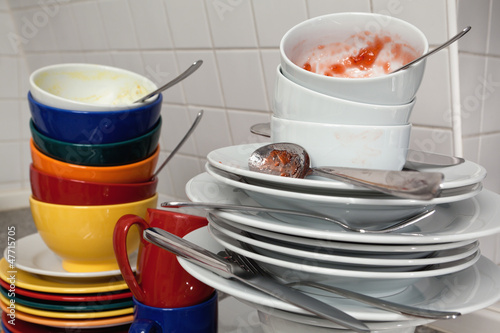
This screenshot has width=500, height=333. I want to click on bowls, so click(62, 89), click(58, 131), click(60, 151), click(59, 165), click(57, 187), click(56, 228), click(325, 119), click(325, 139), click(369, 87).